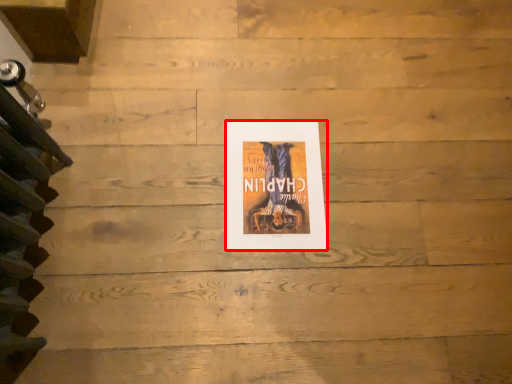
Question: From the image's perspective, considering the relative positions of poster (annotated by the red box) and stairwell in the image provided, where is poster (annotated by the red box) located with respect to the staircase?

Choices:
 (A) below
 (B) above

Answer: (B)